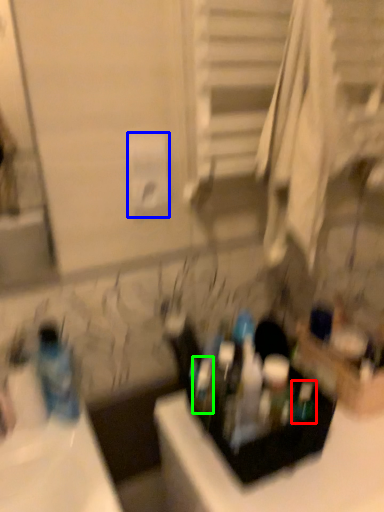
Question: Which object is positioned closest to mouthwash (highlighted by a red box)? Select from toilet paper (highlighted by a blue box) and toiletry (highlighted by a green box).

Choices:
 (A) toilet paper
 (B) toiletry

Answer: (B)